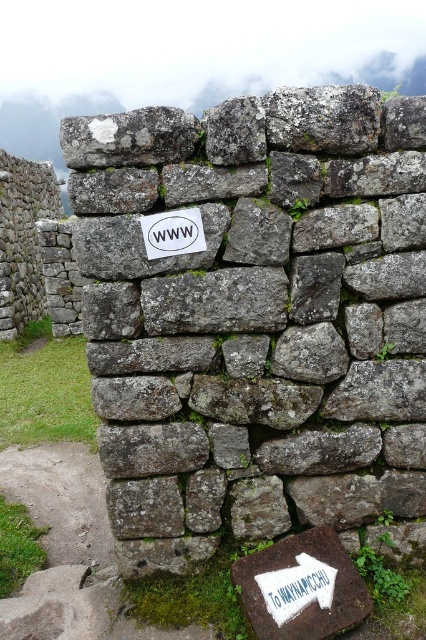
You are standing in front of an ancient stone wall with two points marked on it. You need to determine which point is closer to you. The points are labeled as point (284, 593) and point (192, 212). Which point is closer to your current position?

Point (192, 212) is closer to you because it is less further to the camera than point (284, 593).

You are standing in front of an ancient stone wall with two notable stones. The gray rough stone at center and the white painted stone at lower right. Which stone is located higher up on the wall?

The gray rough stone at center is positioned over the white painted stone at lower right, so it is higher up on the wall.